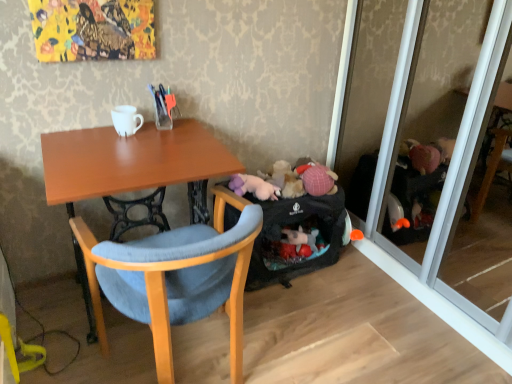
This screenshot has height=384, width=512. Identify the location of free space between wooden table at center and black fabric luggage at lower right. (278, 296).